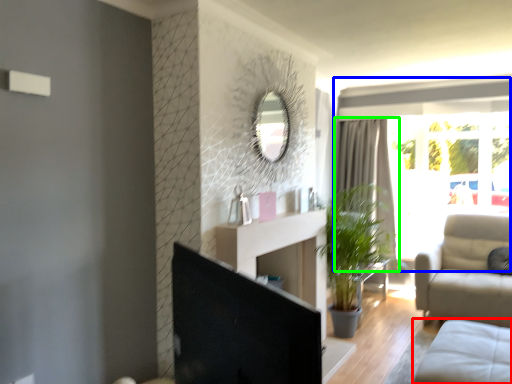
Question: Estimate the real-world distances between objects in this image. Which object is farther from studio couch (highlighted by a red box), window (highlighted by a blue box) or curtain (highlighted by a green box)?

Choices:
 (A) window
 (B) curtain

Answer: (B)